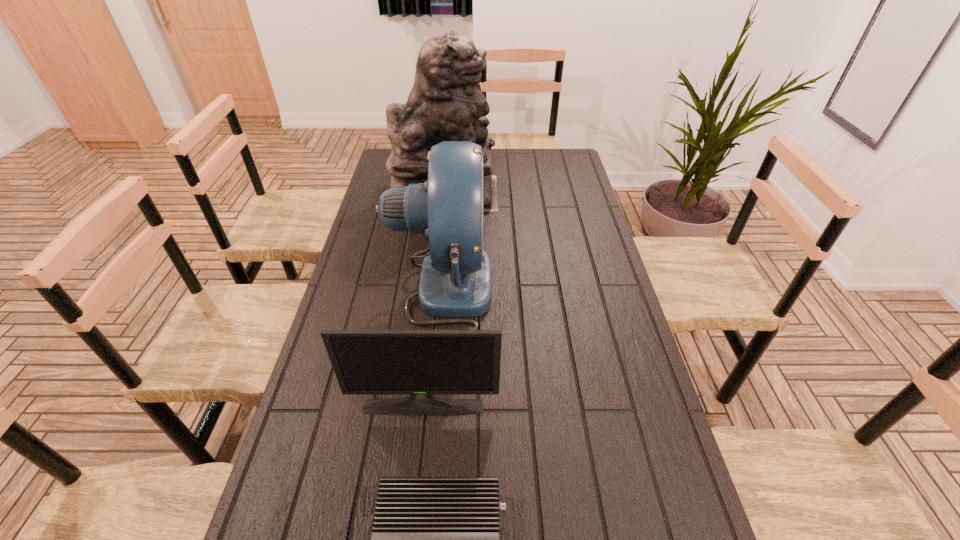
This screenshot has width=960, height=540. I want to click on sculpture, so click(x=446, y=103).

This screenshot has height=540, width=960. What are the coordinates of `the farthest object` in the screenshot? It's located at (446, 103).

This screenshot has height=540, width=960. What are the coordinates of `the second farthest object` in the screenshot? It's located at (455, 281).

Locate an element on the screen. The width and height of the screenshot is (960, 540). the second tallest object is located at coordinates (455, 281).

This screenshot has height=540, width=960. Identify the location of the third tallest object. (366, 362).

Identify the location of monitor. This screenshot has height=540, width=960. (366, 362).

Where is `free region located on the front-facing side of the tallest object`? The width and height of the screenshot is (960, 540). free region located on the front-facing side of the tallest object is located at coordinates (540, 193).

The image size is (960, 540). Find the location of `free location located in front of the second tallest object to blow air`. free location located in front of the second tallest object to blow air is located at coordinates (508, 289).

I want to click on vacant region located on the front-facing side of the second nearest object, so click(418, 455).

Find the location of a particular element. object that is at the far edge is located at coordinates (446, 103).